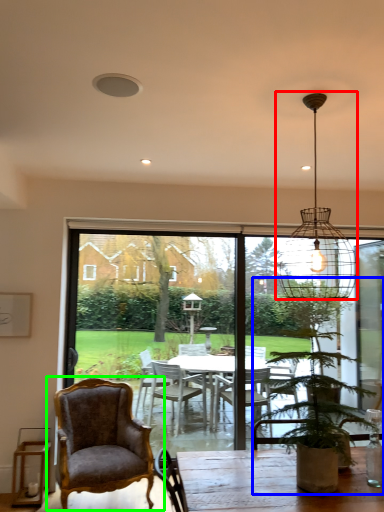
Question: Based on their relative distances, which object is farther from light fixture (highlighted by a red box)? Choose from houseplant (highlighted by a blue box) and chair (highlighted by a green box).

Choices:
 (A) houseplant
 (B) chair

Answer: (B)